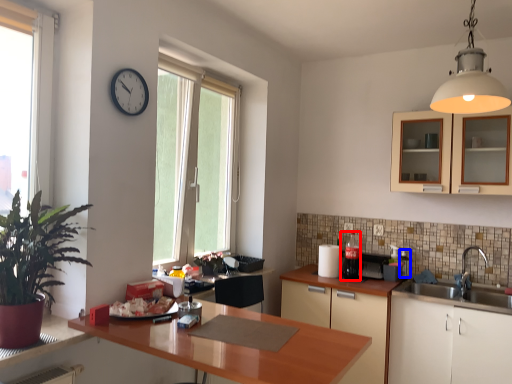
Question: Which point is further to the camera, appliance (highlighted by a red box) or appliance (highlighted by a blue box)?

Choices:
 (A) appliance
 (B) appliance

Answer: (B)